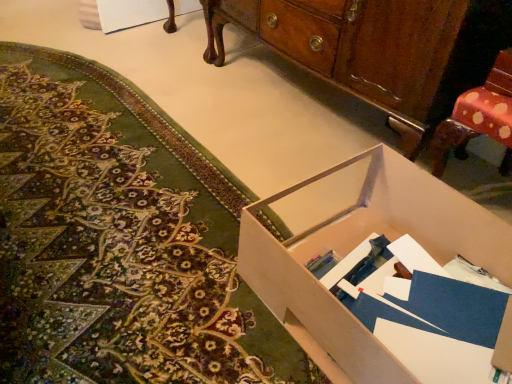
Locate an element on the screen. The width and height of the screenshot is (512, 384). wooden cabinet at center is located at coordinates (379, 49).

This screenshot has width=512, height=384. What do you see at coordinates (120, 241) in the screenshot? I see `matte cardboard box at lower right` at bounding box center [120, 241].

Where is `wooden cabinet at center`? The width and height of the screenshot is (512, 384). wooden cabinet at center is located at coordinates click(x=379, y=49).

You are a GUI agent. You are given a task and a screenshot of the screen. Output one action in this format:
    pyautogui.click(x=<x>, y=<y>)
    Task: Click on the desk that is in front of the matte cardboard box at lower right
    The width and height of the screenshot is (512, 384).
    Given the screenshot: What is the action you would take?
    pyautogui.click(x=356, y=246)

Between point (311, 229) and point (225, 333), which one is positioned in front?

The point (225, 333) is in front.

Is white cardboard box at center with matte cardboard box at lower right?

No, white cardboard box at center is not in contact with matte cardboard box at lower right.

From the picture: From a real-world perspective, is white cardboard box at center physically below matte cardboard box at lower right?

Actually, white cardboard box at center is physically above matte cardboard box at lower right in the real world.

Looking at this image, how different are the orientations of white cardboard box at center and wooden cabinet at center in degrees?

0.457 degrees.

Locate an element on the screen. cabinetry on the left of white cardboard box at center is located at coordinates (379, 49).

Is wooden cabinet at center completely or partially inside white cardboard box at center?

Definitely not — wooden cabinet at center is not inside white cardboard box at center.

Would you say white cardboard box at center is a long distance from wooden cabinet at center?

white cardboard box at center is actually quite close to wooden cabinet at center.

Is wooden cabinet at center aimed at matte cardboard box at lower right?

Yes.

Consider the image. Considering the positions of objects wooden cabinet at center and matte cardboard box at lower right in the image provided, who is more to the right, wooden cabinet at center or matte cardboard box at lower right?

Positioned to the right is wooden cabinet at center.

Is matte cardboard box at lower right surrounded by wooden cabinet at center?

No, wooden cabinet at center does not contain matte cardboard box at lower right.

Is matte cardboard box at lower right taller than white cardboard box at center?

In fact, matte cardboard box at lower right may be shorter than white cardboard box at center.

Which object is wider, matte cardboard box at lower right or white cardboard box at center?

With larger width is matte cardboard box at lower right.

Is matte cardboard box at lower right facing away from white cardboard box at center?

No.

Considering the positions of objects matte cardboard box at lower right and wooden cabinet at center in the image provided, who is in front, matte cardboard box at lower right or wooden cabinet at center?

matte cardboard box at lower right is more forward.

Considering the sizes of matte cardboard box at lower right and wooden cabinet at center in the image, is matte cardboard box at lower right bigger or smaller than wooden cabinet at center?

In the image, matte cardboard box at lower right appears to be smaller than wooden cabinet at center.

From the image's perspective, is matte cardboard box at lower right beneath wooden cabinet at center?

Indeed, from the image's perspective, matte cardboard box at lower right is shown beneath wooden cabinet at center.

Find the location of a particular element. desk on the right of wooden cabinet at center is located at coordinates (356, 246).

Considering the relative sizes of wooden cabinet at center and white cardboard box at center in the image provided, is wooden cabinet at center wider than white cardboard box at center?

Incorrect, the width of wooden cabinet at center does not surpass that of white cardboard box at center.

Which is more to the right, wooden cabinet at center or white cardboard box at center?

white cardboard box at center.

At what (x,y) coordinates should I click in order to perform the action: click on desk below the matte cardboard box at lower right (from the image's perspective). Please return your answer as a coordinate pair (x, y). Looking at the image, I should click on (356, 246).

I want to click on cabinetry above the white cardboard box at center (from a real-world perspective), so click(x=379, y=49).

Considering their positions, is wooden cabinet at center positioned further to white cardboard box at center than matte cardboard box at lower right?

wooden cabinet at center is further to white cardboard box at center.

Based on their spatial positions, is matte cardboard box at lower right or wooden cabinet at center further from white cardboard box at center?

wooden cabinet at center.

From the picture: Estimate the real-world distances between objects in this image. Which object is further from wooden cabinet at center, matte cardboard box at lower right or white cardboard box at center?

Among the two, matte cardboard box at lower right is located further to wooden cabinet at center.

Looking at the image, which one is located further to matte cardboard box at lower right, white cardboard box at center or wooden cabinet at center?

Based on the image, wooden cabinet at center appears to be further to matte cardboard box at lower right.

Based on their spatial positions, is white cardboard box at center or matte cardboard box at lower right further from wooden cabinet at center?

matte cardboard box at lower right is further to wooden cabinet at center.

Based on their spatial positions, is wooden cabinet at center or white cardboard box at center closer to matte cardboard box at lower right?

white cardboard box at center.

I want to click on cabinetry between matte cardboard box at lower right and white cardboard box at center from left to right, so 379,49.